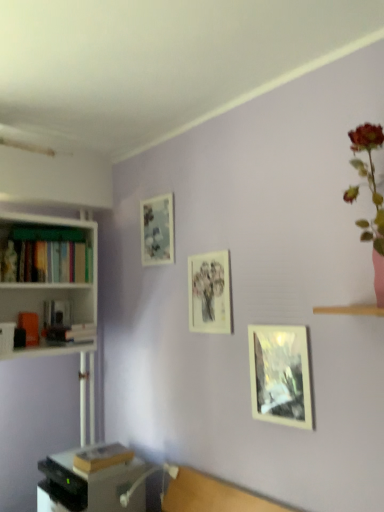
Find the location of a particular element. matte paper picture frame at center, which is counted as the 2th picture frame, starting from the right is located at coordinates (209, 293).

I want to click on metallic gray desk at lower left, so click(x=94, y=483).

The width and height of the screenshot is (384, 512). I want to click on hardcover book at lower left, the 1th book in the bottom-to-top sequence, so click(102, 457).

Find the location of a particular element. Image resolution: width=384 pixels, height=512 pixels. matte paper picture frame at center, arranged as the second picture frame when viewed from the top is located at coordinates (209, 293).

Is matte glass picture frame at center-right, positioned as the third picture frame in back-to-front order, bigger than hardcover book at lower left, the 3th book positioned from the top?

Actually, matte glass picture frame at center-right, positioned as the third picture frame in back-to-front order, might be smaller than hardcover book at lower left, the 3th book positioned from the top.

From the image's perspective, which is below, matte glass picture frame at center-right, the 1th picture frame from the bottom, or hardcover book at lower left, the 1th book in the bottom-to-top sequence?

hardcover book at lower left, the 1th book in the bottom-to-top sequence, from the image's perspective.

Which point is more forward, (264, 358) or (80, 454)?

Positioned in front is point (264, 358).

Looking at this image, between matte glass picture frame at center-right, which ranks as the 3th picture frame in top-to-bottom order, and hardcover book at lower left, the 3th book positioned from the top, which one has less height?

hardcover book at lower left, the 3th book positioned from the top.

Considering the relative sizes of hardcover book at lower left, the 3th book positioned from the top, and white matte bookshelf at left in the image provided, is hardcover book at lower left, the 3th book positioned from the top, bigger than white matte bookshelf at left?

Actually, hardcover book at lower left, the 3th book positioned from the top, might be smaller than white matte bookshelf at left.

Would you say hardcover book at lower left, the 3th book positioned from the top, is inside or outside white matte bookshelf at left?

hardcover book at lower left, the 3th book positioned from the top, exists outside the volume of white matte bookshelf at left.

Is hardcover book at lower left, the 3th book positioned from the top, wider or thinner than white matte bookshelf at left?

Considering their sizes, hardcover book at lower left, the 3th book positioned from the top, looks slimmer than white matte bookshelf at left.

Is hardcover book at lower left, the 1th book in the bottom-to-top sequence, with white matte bookshelf at left?

hardcover book at lower left, the 1th book in the bottom-to-top sequence, is not next to white matte bookshelf at left, and they're not touching.

Is hardcover book at lower left, the 1th book in the bottom-to-top sequence, smaller than hardcover book at left, acting as the 2th book starting from the top?

Yes.

From a real-world perspective, count 1st books upward from the hardcover book at lower left, the 3th book positioned from the top, and point to it. Please provide its 2D coordinates.

[(72, 333)]

Considering the relative sizes of hardcover book at lower left, the 1th book in the bottom-to-top sequence, and hardcover book at left, acting as the 2th book starting from the top, in the image provided, is hardcover book at lower left, the 1th book in the bottom-to-top sequence, taller than hardcover book at left, acting as the 2th book starting from the top,?

In fact, hardcover book at lower left, the 1th book in the bottom-to-top sequence, may be shorter than hardcover book at left, acting as the 2th book starting from the top.

Is matte glass picture frame at upper left, which is the 1th picture frame in left-to-right order, not close to matte glass picture frame at center-right, which appears as the 1th picture frame when viewed from the right?

No, there isn't a large distance between matte glass picture frame at upper left, which is the 1th picture frame in left-to-right order, and matte glass picture frame at center-right, which appears as the 1th picture frame when viewed from the right.

Is point (141, 215) farther from viewer compared to point (280, 327)?

Yes, point (141, 215) is farther from viewer.

From a real-world perspective, which object rests below the other?

matte glass picture frame at center-right, which ranks as the 3th picture frame in top-to-bottom order, from a real-world perspective.

How distant is matte glass picture frame at upper left, arranged as the 3th picture frame when ordered from the bottom, from matte glass picture frame at center-right, which is counted as the 3th picture frame, starting from the left?

The distance of matte glass picture frame at upper left, arranged as the 3th picture frame when ordered from the bottom, from matte glass picture frame at center-right, which is counted as the 3th picture frame, starting from the left, is 74.73 centimeters.

Considering the relative sizes of white matte bookshelf at left and matte paper picture frame at center, the 2th picture frame viewed from the front, in the image provided, is white matte bookshelf at left smaller than matte paper picture frame at center, the 2th picture frame viewed from the front,?

Incorrect, white matte bookshelf at left is not smaller in size than matte paper picture frame at center, the 2th picture frame viewed from the front.

From the image's perspective, is white matte bookshelf at left on top of matte paper picture frame at center, arranged as the second picture frame when viewed from the top?

No, from the image's perspective, white matte bookshelf at left is not above matte paper picture frame at center, arranged as the second picture frame when viewed from the top.

How different are the orientations of white matte bookshelf at left and matte paper picture frame at center, the second picture frame in the left-to-right sequence, in degrees?

They differ by 90 degrees in their facing directions.

Between white matte bookshelf at left and matte paper picture frame at center, the 2th picture frame viewed from the front, which one has larger width?

With larger width is white matte bookshelf at left.

Would you say matte glass picture frame at center-right, the 1th picture frame from the bottom, is inside or outside hardcover book at left, acting as the 2th book starting from the top?

matte glass picture frame at center-right, the 1th picture frame from the bottom, exists outside the volume of hardcover book at left, acting as the 2th book starting from the top.

Does matte glass picture frame at center-right, which is counted as the 3th picture frame, starting from the left, come behind hardcover book at left, acting as the second book starting from the bottom?

That is False.

From the image's perspective, which one is positioned higher, matte glass picture frame at center-right, placed as the first picture frame when sorted from front to back, or hardcover book at left, acting as the 2th book starting from the top?

hardcover book at left, acting as the 2th book starting from the top, from the image's perspective.

Measure the distance from matte glass picture frame at center-right, which ranks as the 3th picture frame in top-to-bottom order, to hardcover book at left, acting as the second book starting from the bottom.

The distance of matte glass picture frame at center-right, which ranks as the 3th picture frame in top-to-bottom order, from hardcover book at left, acting as the second book starting from the bottom, is 3.35 feet.

Which is more distant, (13, 357) or (172, 244)?

The point (13, 357) is behind.

From a real-world perspective, is white matte bookshelf at left on matte glass picture frame at upper left, positioned as the third picture frame in front-to-back order?

No, from a real-world perspective, white matte bookshelf at left is not above matte glass picture frame at upper left, positioned as the third picture frame in front-to-back order.

Is white matte bookshelf at left inside the boundaries of matte glass picture frame at upper left, positioned as the third picture frame in front-to-back order, or outside?

white matte bookshelf at left is spatially situated outside matte glass picture frame at upper left, positioned as the third picture frame in front-to-back order.

From the image's perspective, is white matte bookshelf at left under matte glass picture frame at upper left, which is the 1th picture frame in left-to-right order?

Yes.

From the image's perspective, which picture frame is the 1st one above the hardcover book at lower left, the 1th book in the bottom-to-top sequence? Please provide its 2D coordinates.

[(280, 375)]

The width and height of the screenshot is (384, 512). What are the coordinates of `bookcase behind the hardcover book at lower left, the 3th book positioned from the top` in the screenshot? It's located at (51, 283).

In the scene shown: When comparing their distances from hardcover book at left, acting as the 2th book starting from the top, does metallic gray desk at lower left or matte glass picture frame at center-right, placed as the first picture frame when sorted from front to back, seem further?

Among the two, matte glass picture frame at center-right, placed as the first picture frame when sorted from front to back, is located further to hardcover book at left, acting as the 2th book starting from the top.

Based on the photo, which object lies nearer to the anchor point metallic gray desk at lower left, hardcover books at left, positioned as the third book in bottom-to-top order, or white matte bookshelf at left?

white matte bookshelf at left.

From the image, which object appears to be farther from white matte bookshelf at left, matte glass picture frame at center-right, placed as the first picture frame when sorted from front to back, or hardcover book at left, acting as the second book starting from the bottom?

The object further to white matte bookshelf at left is matte glass picture frame at center-right, placed as the first picture frame when sorted from front to back.

Looking at the image, which one is located closer to hardcover book at left, acting as the 2th book starting from the top, matte glass picture frame at upper left, which is the 1th picture frame in left-to-right order, or matte paper picture frame at center, arranged as the second picture frame when viewed from the top?

Based on the image, matte glass picture frame at upper left, which is the 1th picture frame in left-to-right order, appears to be nearer to hardcover book at left, acting as the 2th book starting from the top.

From the image, which object appears to be farther from metallic gray desk at lower left, hardcover book at left, acting as the 2th book starting from the top, or hardcover book at lower left, the 3th book positioned from the top?

hardcover book at left, acting as the 2th book starting from the top.

Estimate the real-world distances between objects in this image. Which object is further from metallic gray desk at lower left, matte glass picture frame at upper left, arranged as the first picture frame when viewed from the back, or matte paper picture frame at center, which is counted as the 2th picture frame, starting from the right?

matte glass picture frame at upper left, arranged as the first picture frame when viewed from the back.

Looking at the image, which one is located further to matte paper picture frame at center, which is counted as the 2th picture frame, starting from the right, matte glass picture frame at center-right, placed as the first picture frame when sorted from front to back, or metallic gray desk at lower left?

metallic gray desk at lower left is further to matte paper picture frame at center, which is counted as the 2th picture frame, starting from the right.

Looking at the image, which one is located closer to metallic gray desk at lower left, hardcover books at left, acting as the 1th book starting from the top, or matte paper picture frame at center, the second picture frame in the left-to-right sequence?

matte paper picture frame at center, the second picture frame in the left-to-right sequence, lies closer to metallic gray desk at lower left than the other object.

The image size is (384, 512). Identify the location of book between metallic gray desk at lower left and matte glass picture frame at center-right, the 1th picture frame from the bottom, from left to right. (102, 457).

The height and width of the screenshot is (512, 384). I want to click on book between white matte bookshelf at left and hardcover book at lower left, the 1th book in the bottom-to-top sequence, in the up-down direction, so click(72, 333).

Where is `bookcase between hardcover books at left, acting as the 1th book starting from the top, and metallic gray desk at lower left vertically`? This screenshot has height=512, width=384. bookcase between hardcover books at left, acting as the 1th book starting from the top, and metallic gray desk at lower left vertically is located at coordinates (51, 283).

In order to click on book between hardcover book at left, acting as the second book starting from the bottom, and matte glass picture frame at center-right, the 1th picture frame from the bottom in this screenshot , I will do `click(102, 457)`.